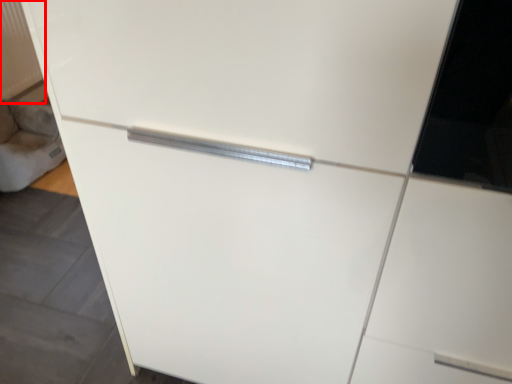
Question: From the image, what is the correct spatial relationship of radiator (annotated by the red box) in relation to gray?

Choices:
 (A) left
 (B) right

Answer: (A)